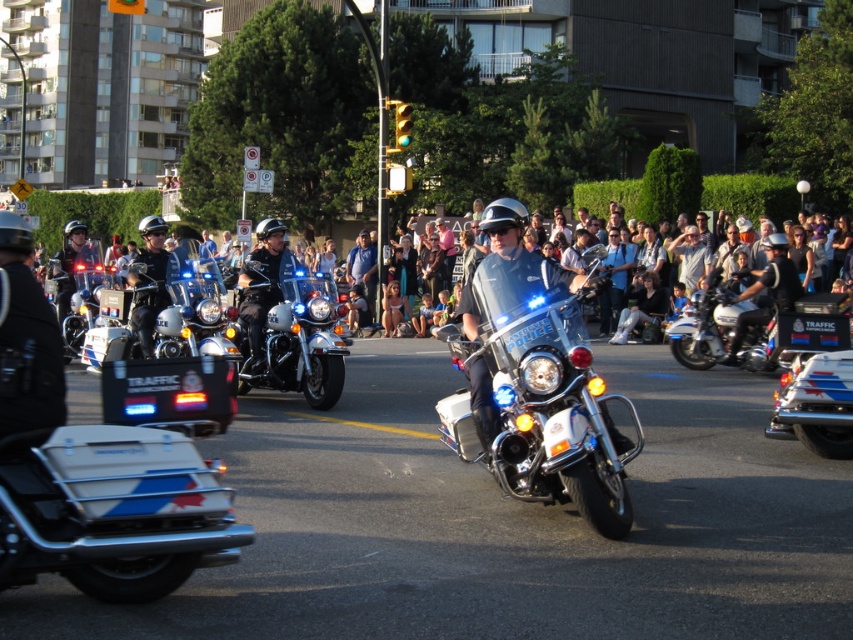
Question: Is white glossy motorcycle at center positioned at the back of white glossy police motorcycle at center?

Choices:
 (A) yes
 (B) no

Answer: (A)

Question: Considering the relative positions of white glossy police motorcycle at center and metallic silver helmet at center in the image provided, where is white glossy police motorcycle at center located with respect to metallic silver helmet at center?

Choices:
 (A) above
 (B) below

Answer: (A)

Question: Does polished chrome motorcycle at center have a greater width compared to metallic silver helmet at center?

Choices:
 (A) yes
 (B) no

Answer: (A)

Question: Which object is the farthest from the metallic silver helmet at center?

Choices:
 (A) white glossy motorcycle at center
 (B) metallic blue motorcycle at center

Answer: (B)

Question: Which point appears closest to the camera in this image?

Choices:
 (A) (815, 404)
 (B) (244, 376)

Answer: (A)

Question: Considering the real-world distances, which object is farthest from the white glossy motorcycle at center?

Choices:
 (A) metallic silver helmet at center
 (B) white glossy police motorcycle at center

Answer: (B)